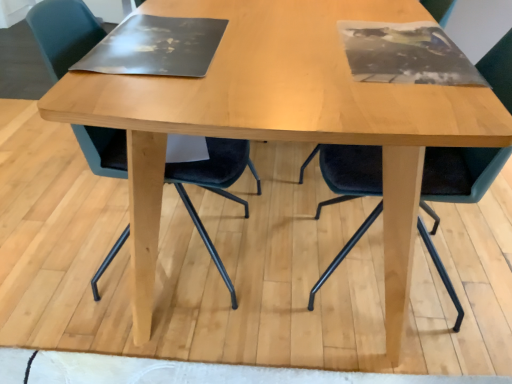
The width and height of the screenshot is (512, 384). I want to click on velvet dark green chair at left, which is the 2th chair in right-to-left order, so click(214, 185).

The image size is (512, 384). What do you see at coordinates (214, 185) in the screenshot?
I see `velvet dark green chair at left, acting as the 1th chair starting from the left` at bounding box center [214, 185].

Locate an element on the screen. The height and width of the screenshot is (384, 512). velvet dark blue chair at center, which ranks as the 1th chair in right-to-left order is located at coordinates (456, 190).

This screenshot has width=512, height=384. Describe the element at coordinates (456, 190) in the screenshot. I see `velvet dark blue chair at center, the second chair in the left-to-right sequence` at that location.

Identify the location of velvet dark green chair at left, which is the 2th chair in right-to-left order. The height and width of the screenshot is (384, 512). (214, 185).

Based on the photo, is velvet dark blue chair at center, which ranks as the 1th chair in right-to-left order, to the left of velvet dark green chair at left, acting as the 1th chair starting from the left, from the viewer's perspective?

No.

Which object is closer to the camera taking this photo, velvet dark blue chair at center, the second chair in the left-to-right sequence, or velvet dark green chair at left, acting as the 1th chair starting from the left?

Positioned in front is velvet dark blue chair at center, the second chair in the left-to-right sequence.

Which is behind, point (450, 164) or point (204, 170)?

The point (450, 164) is farther from the camera.

In the scene shown: From the image's perspective, relative to velvet dark green chair at left, which is the 2th chair in right-to-left order, is velvet dark blue chair at center, which ranks as the 1th chair in right-to-left order, above or below?

velvet dark blue chair at center, which ranks as the 1th chair in right-to-left order, is situated lower than velvet dark green chair at left, which is the 2th chair in right-to-left order, in the image.

From a real-world perspective, between velvet dark blue chair at center, which ranks as the 1th chair in right-to-left order, and velvet dark green chair at left, acting as the 1th chair starting from the left, who is vertically lower?

In real-world perspective, velvet dark green chair at left, acting as the 1th chair starting from the left, is lower.

Between velvet dark blue chair at center, which ranks as the 1th chair in right-to-left order, and velvet dark green chair at left, acting as the 1th chair starting from the left, which one has smaller width?

Thinner between the two is velvet dark blue chair at center, which ranks as the 1th chair in right-to-left order.

From their relative heights in the image, would you say velvet dark blue chair at center, the second chair in the left-to-right sequence, is taller or shorter than velvet dark green chair at left, which is the 2th chair in right-to-left order?

Considering their sizes, velvet dark blue chair at center, the second chair in the left-to-right sequence, has less height than velvet dark green chair at left, which is the 2th chair in right-to-left order.

Considering the sizes of objects velvet dark blue chair at center, which ranks as the 1th chair in right-to-left order, and velvet dark green chair at left, which is the 2th chair in right-to-left order, in the image provided, who is bigger, velvet dark blue chair at center, which ranks as the 1th chair in right-to-left order, or velvet dark green chair at left, which is the 2th chair in right-to-left order,?

velvet dark green chair at left, which is the 2th chair in right-to-left order.

Is velvet dark blue chair at center, the second chair in the left-to-right sequence, not within velvet dark green chair at left, which is the 2th chair in right-to-left order?

Absolutely, velvet dark blue chair at center, the second chair in the left-to-right sequence, is external to velvet dark green chair at left, which is the 2th chair in right-to-left order.

Would you consider velvet dark blue chair at center, which ranks as the 1th chair in right-to-left order, to be distant from velvet dark green chair at left, which is the 2th chair in right-to-left order?

No, velvet dark blue chair at center, which ranks as the 1th chair in right-to-left order, is not far from velvet dark green chair at left, which is the 2th chair in right-to-left order.

Could you tell me if velvet dark blue chair at center, the second chair in the left-to-right sequence, is turned towards velvet dark green chair at left, which is the 2th chair in right-to-left order?

Yes, velvet dark blue chair at center, the second chair in the left-to-right sequence, faces towards velvet dark green chair at left, which is the 2th chair in right-to-left order.

How different are the orientations of velvet dark blue chair at center, which ranks as the 1th chair in right-to-left order, and velvet dark green chair at left, which is the 2th chair in right-to-left order, in degrees?

They differ by 175 degrees in their facing directions.

In the image, there is a velvet dark blue chair at center, the second chair in the left-to-right sequence. Identify the location of chair above it (from the image's perspective). (214, 185).

Can you confirm if velvet dark green chair at left, which is the 2th chair in right-to-left order, is positioned to the right of velvet dark blue chair at center, the second chair in the left-to-right sequence?

No.

Relative to velvet dark blue chair at center, which ranks as the 1th chair in right-to-left order, is velvet dark green chair at left, acting as the 1th chair starting from the left, in front or behind?

velvet dark green chair at left, acting as the 1th chair starting from the left, is positioned farther from the viewer than velvet dark blue chair at center, which ranks as the 1th chair in right-to-left order.

Considering the positions of point (106, 141) and point (490, 152), is point (106, 141) closer or farther from the camera than point (490, 152)?

Point (106, 141) is positioned farther from the camera compared to point (490, 152).

Looking at this image, from the image's perspective, which one is positioned lower, velvet dark green chair at left, acting as the 1th chair starting from the left, or velvet dark blue chair at center, which ranks as the 1th chair in right-to-left order?

From the image's view, velvet dark blue chair at center, which ranks as the 1th chair in right-to-left order, is below.

From a real-world perspective, who is located lower, velvet dark green chair at left, which is the 2th chair in right-to-left order, or velvet dark blue chair at center, which ranks as the 1th chair in right-to-left order?

velvet dark green chair at left, which is the 2th chair in right-to-left order, is physically lower.

Which object is wider, velvet dark green chair at left, acting as the 1th chair starting from the left, or velvet dark blue chair at center, the second chair in the left-to-right sequence?

velvet dark green chair at left, acting as the 1th chair starting from the left, is wider.

Is velvet dark green chair at left, which is the 2th chair in right-to-left order, taller than velvet dark blue chair at center, which ranks as the 1th chair in right-to-left order?

Yes, velvet dark green chair at left, which is the 2th chair in right-to-left order, is taller than velvet dark blue chair at center, which ranks as the 1th chair in right-to-left order.

Can you confirm if velvet dark green chair at left, which is the 2th chair in right-to-left order, is bigger than velvet dark blue chair at center, the second chair in the left-to-right sequence?

Yes, velvet dark green chair at left, which is the 2th chair in right-to-left order, is bigger than velvet dark blue chair at center, the second chair in the left-to-right sequence.

Is velvet dark blue chair at center, the second chair in the left-to-right sequence, inside velvet dark green chair at left, which is the 2th chair in right-to-left order?

No, velvet dark blue chair at center, the second chair in the left-to-right sequence, is not surrounded by velvet dark green chair at left, which is the 2th chair in right-to-left order.

Is velvet dark green chair at left, which is the 2th chair in right-to-left order, not near velvet dark blue chair at center, which ranks as the 1th chair in right-to-left order?

velvet dark green chair at left, which is the 2th chair in right-to-left order, is actually quite close to velvet dark blue chair at center, which ranks as the 1th chair in right-to-left order.

Is velvet dark green chair at left, which is the 2th chair in right-to-left order, aimed at velvet dark blue chair at center, the second chair in the left-to-right sequence?

Yes, velvet dark green chair at left, which is the 2th chair in right-to-left order, faces towards velvet dark blue chair at center, the second chair in the left-to-right sequence.

Looking at this image, how distant is velvet dark green chair at left, which is the 2th chair in right-to-left order, from velvet dark blue chair at center, which ranks as the 1th chair in right-to-left order?

The distance of velvet dark green chair at left, which is the 2th chair in right-to-left order, from velvet dark blue chair at center, which ranks as the 1th chair in right-to-left order, is 20.87 inches.

Where is `chair above the velvet dark blue chair at center, which ranks as the 1th chair in right-to-left order (from the image's perspective)`? This screenshot has width=512, height=384. chair above the velvet dark blue chair at center, which ranks as the 1th chair in right-to-left order (from the image's perspective) is located at coordinates (214, 185).

Where is `chair below the velvet dark green chair at left, acting as the 1th chair starting from the left (from the image's perspective)`? chair below the velvet dark green chair at left, acting as the 1th chair starting from the left (from the image's perspective) is located at coordinates (456, 190).

I want to click on chair to the left of velvet dark blue chair at center, the second chair in the left-to-right sequence, so click(214, 185).